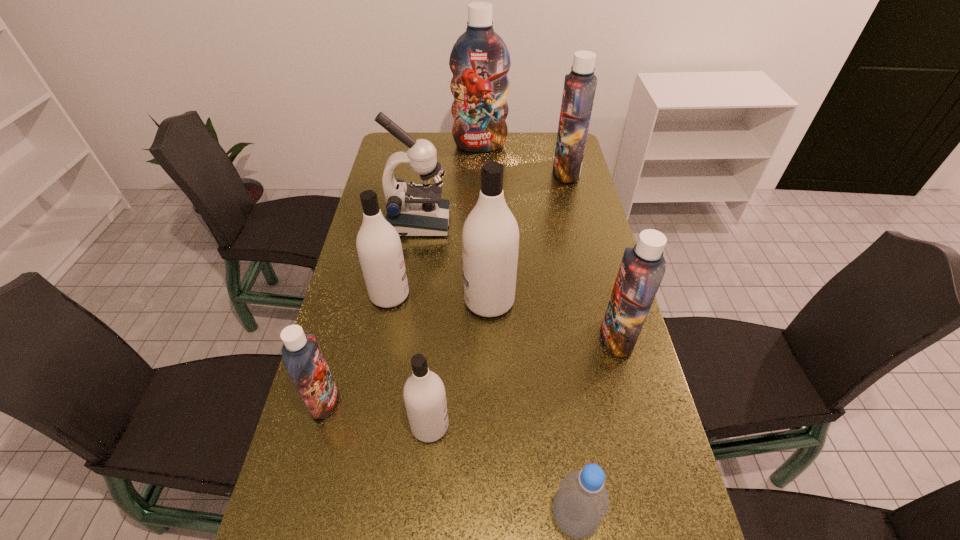
The width and height of the screenshot is (960, 540). In order to click on vacant space situated 0.220m at the eyepiece of the microscope in this screenshot , I will do `click(513, 223)`.

Find the location of `vacant area located on the front label of the second nearest blue shampoo`. vacant area located on the front label of the second nearest blue shampoo is located at coordinates (571, 338).

Where is `vacant position located on the front label of the second nearest blue shampoo`? The image size is (960, 540). vacant position located on the front label of the second nearest blue shampoo is located at coordinates (575, 338).

The width and height of the screenshot is (960, 540). What are the coordinates of `free region located 0.250m on the front label of the second nearest blue shampoo` in the screenshot? It's located at 509,338.

Where is `vacant space situated 0.060m on the front-facing side of the second shampoo from left to right`? The width and height of the screenshot is (960, 540). vacant space situated 0.060m on the front-facing side of the second shampoo from left to right is located at coordinates (430, 295).

The image size is (960, 540). I want to click on vacant space situated 0.260m on the front label of the leftmost blue shampoo, so click(x=445, y=401).

Find the location of `vacant position located 0.310m on the front-facing side of the smallest white shampoo`. vacant position located 0.310m on the front-facing side of the smallest white shampoo is located at coordinates (583, 426).

At what (x,y) coordinates should I click in order to perform the action: click on microscope that is positioned at the left edge. Please return your answer as a coordinate pair (x, y). Looking at the image, I should click on (416, 210).

Locate an element on the screen. The image size is (960, 540). object that is at the far right corner is located at coordinates (580, 84).

Locate an element on the screen. This screenshot has width=960, height=540. vacant point at the left edge is located at coordinates (372, 303).